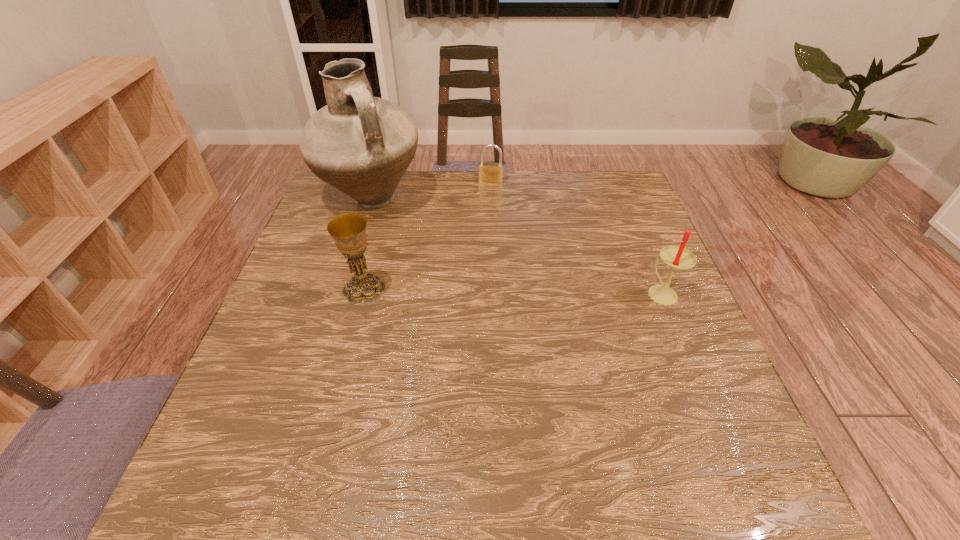
Find the location of a particular element. The image size is (960, 540). free location located 0.300m on the handle side of the tallest object is located at coordinates (482, 273).

Where is `vacant space located 0.280m on the handle side of the tallest object`? vacant space located 0.280m on the handle side of the tallest object is located at coordinates (476, 269).

Identify the location of free space located 0.250m on the handle side of the tallest object. The image size is (960, 540). (468, 264).

At what (x,y) coordinates should I click in order to perform the action: click on padlock located in the far edge section of the desktop. Please return your answer as a coordinate pair (x, y). This screenshot has height=540, width=960. Looking at the image, I should click on (489, 172).

What are the coordinates of `pitcher located in the far edge section of the desktop` in the screenshot? It's located at (362, 145).

Locate an element on the screen. Image resolution: width=960 pixels, height=540 pixels. chalice situated at the left edge is located at coordinates (348, 231).

This screenshot has height=540, width=960. What are the coordinates of `pitcher that is at the left edge` in the screenshot? It's located at (362, 145).

Identify the location of object that is at the right edge. The height and width of the screenshot is (540, 960). (677, 257).

Identify the location of object located at the far left corner. The image size is (960, 540). point(362,145).

You are a GUI agent. You are given a task and a screenshot of the screen. Output one action in this format:
    pyautogui.click(x=<x>, y=<y>)
    Task: Click on the free space at the far edge of the desktop
    
    Given the screenshot: What is the action you would take?
    pyautogui.click(x=458, y=211)